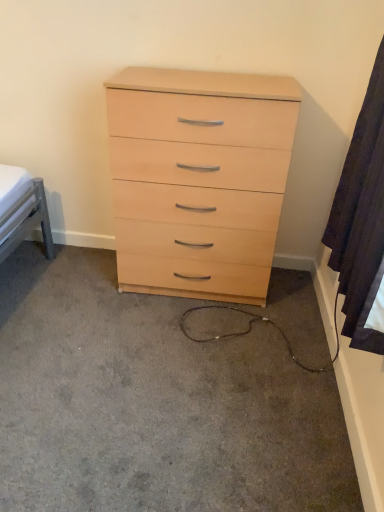
At what (x,y) coordinates should I click in order to perform the action: click on free space above light wood dresser at center (from a real-world perspective). Please return your answer as a coordinate pair (x, y). The width and height of the screenshot is (384, 512). Looking at the image, I should click on (144, 353).